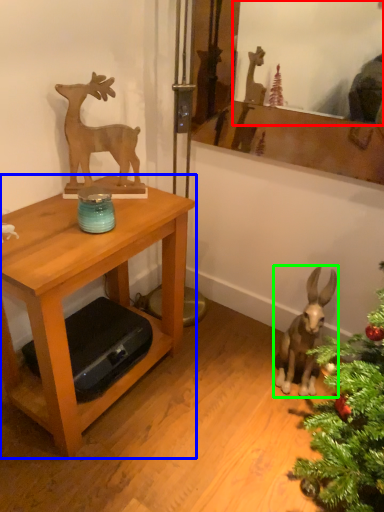
Question: Which object is the closest to the mirror (highlighted by a red box)? Choose among these: table (highlighted by a blue box) or animal (highlighted by a green box).

Choices:
 (A) table
 (B) animal

Answer: (A)